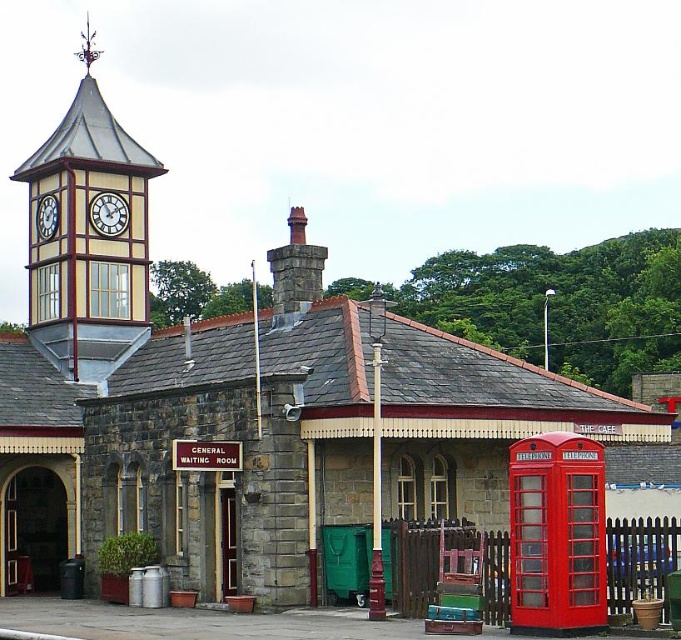
Which is in front, point (118, 260) or point (97, 230)?

Positioned in front is point (97, 230).

Between wooden clock tower at upper left and metallic clock face at upper left, which one appears on the right side from the viewer's perspective?

From the viewer's perspective, metallic clock face at upper left appears more on the right side.

Is point (136, 164) in front of point (125, 216)?

That is True.

Image resolution: width=681 pixels, height=640 pixels. In order to click on wooden clock tower at upper left in this screenshot , I will do `click(89, 237)`.

From the picture: Who is more distant from viewer, (125, 220) or (50, 202)?

The point (50, 202) is behind.

Which is more to the right, metallic clock face at upper left or white clock face at upper left?

Positioned to the right is metallic clock face at upper left.

Is point (114, 212) closer to camera compared to point (57, 221)?

No, (114, 212) is further to viewer.

Where is `metallic clock face at upper left`? The image size is (681, 640). metallic clock face at upper left is located at coordinates (108, 212).

Who is more distant from viewer, (104, 348) or (46, 232)?

The point (46, 232) is behind.

Is wooden clock tower at upper left further to the viewer compared to white clock face at upper left?

No, wooden clock tower at upper left is closer to the viewer.

The height and width of the screenshot is (640, 681). Identify the location of wooden clock tower at upper left. (89, 237).

Find the location of a particular element. The image size is (681, 640). wooden clock tower at upper left is located at coordinates (89, 237).